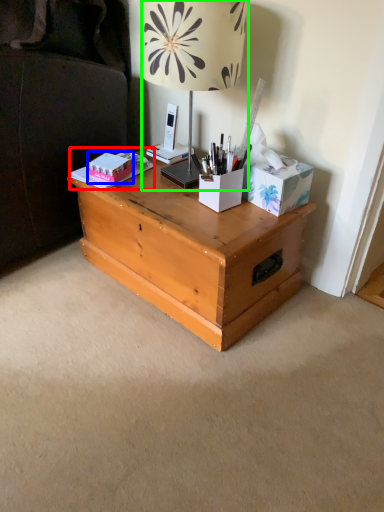
Question: Which object is the farthest from book (highlighted by a red box)? Choose among these: box (highlighted by a blue box) or lamp (highlighted by a green box).

Choices:
 (A) box
 (B) lamp

Answer: (B)